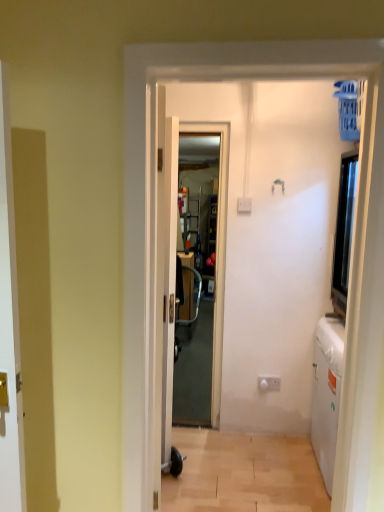
Identify the location of vacant space situated above light brown wood floor at lower center (from a real-world perspective). This screenshot has height=512, width=384. (248, 467).